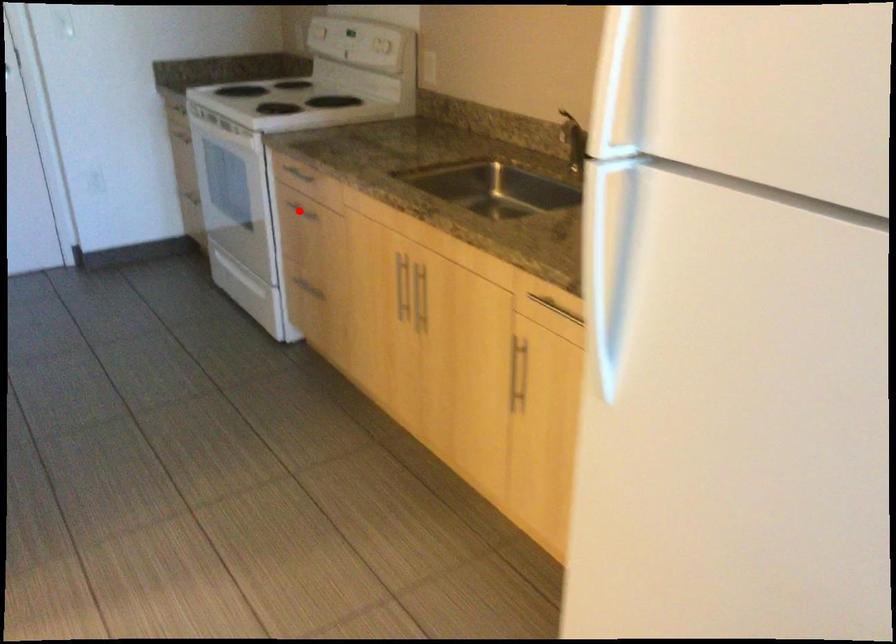
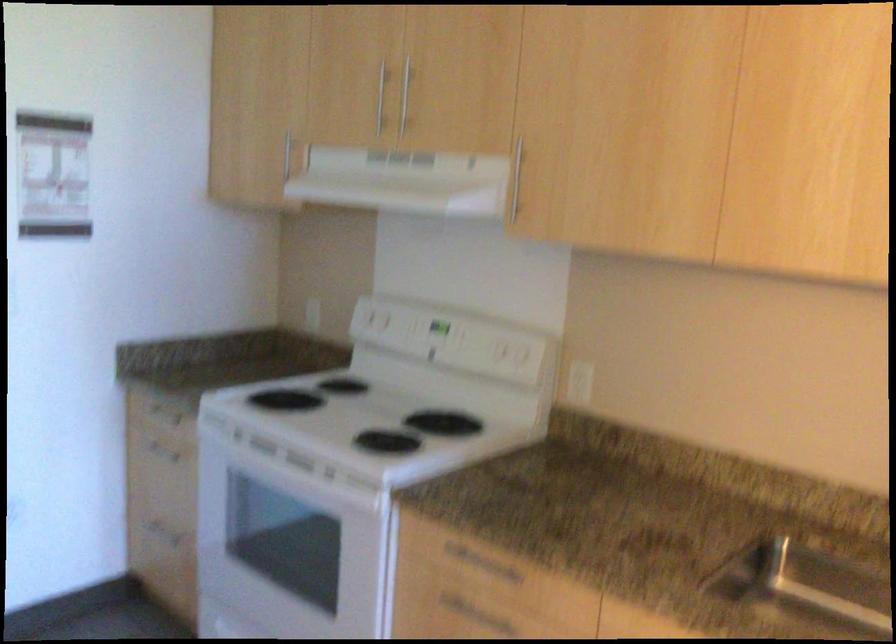
Question: I am providing you with two images of the same scene from different viewpoints. In image1, a red point is highlighted. Considering the same 3D point in image2, which of the following is correct?

Choices:
 (A) It is closer
 (B) It is farther

Answer: (A)